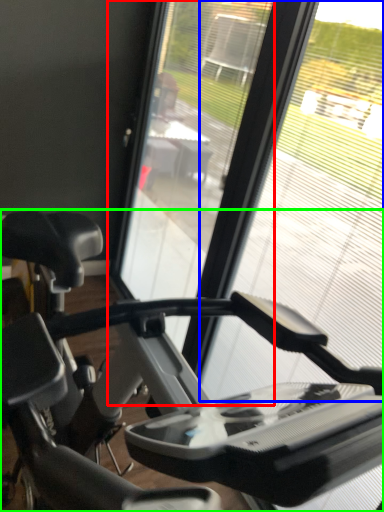
Question: Which is nearer to the screen door (highlighted by a red box)? glass window (highlighted by a blue box) or stationary bicycle (highlighted by a green box).

Choices:
 (A) glass window
 (B) stationary bicycle

Answer: (A)